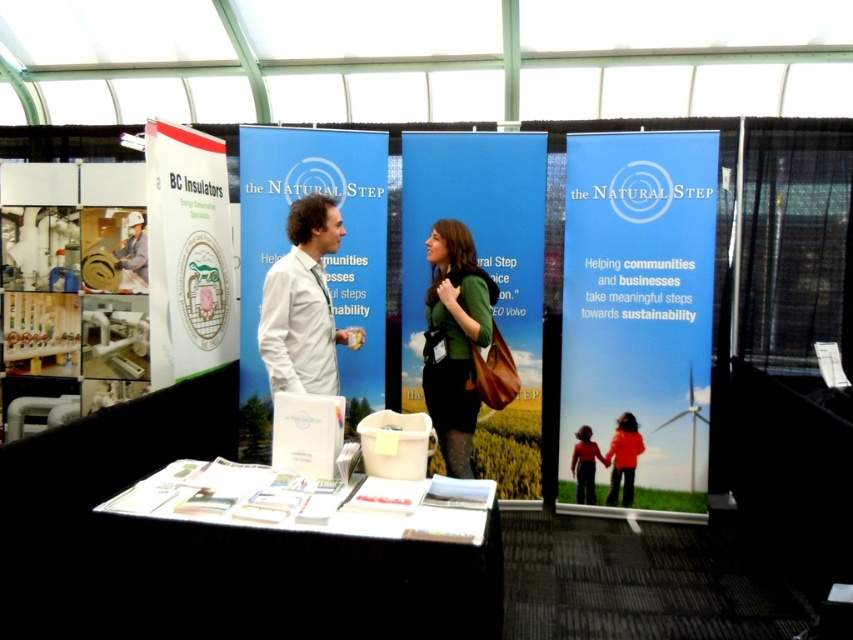
You are attending a trade show and want to read the blue paperboard sign at center. However, the white shirt at center is in your line of sight. Can you see the sign clearly?

The blue paperboard sign at center is much taller than the white shirt at center, so you can see the sign clearly over the white shirt at center.

You are organizing an event and need to ensure that the blue paperboard sign at center is visible to attendees passing by. Considering the white shirt at center, which object is wider and might block the view of the sign if positioned too close?

The blue paperboard sign at center is wider than the white shirt at center, so positioning the white shirt at center too close might block the view of the sign due to its narrower width compared to the sign.

You are at the trade show and need to approach the booth. From your current position, which of the two people should you walk towards first if you want to reach the person wearing the white shirt at center before the green matte dress at center?

You should walk towards the white shirt at center first because it is positioned to the left of the green matte dress at center, making it closer to your current position depending on your angle of approach.